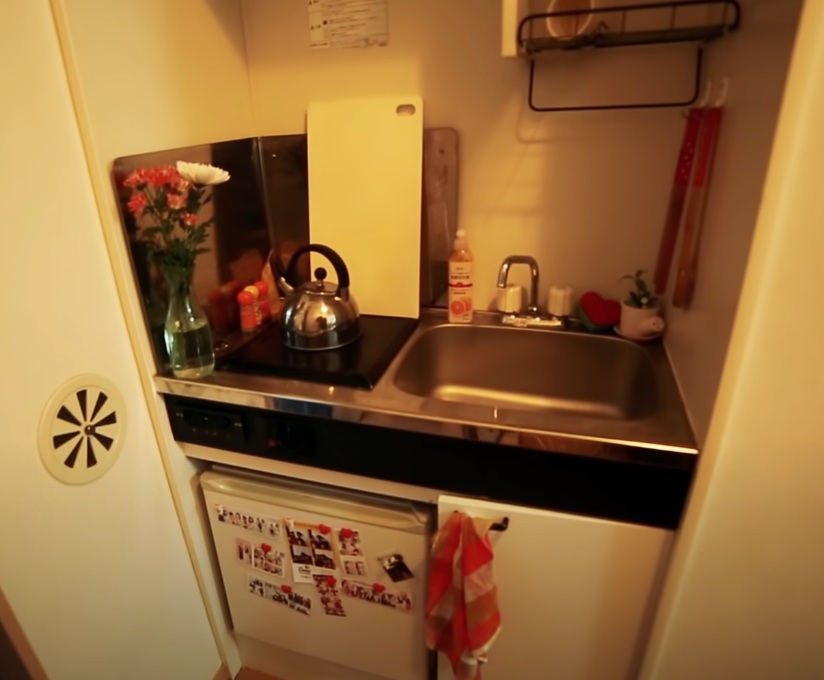
Where is `stainless steel backsplash`? The image size is (824, 680). stainless steel backsplash is located at coordinates (255, 198).